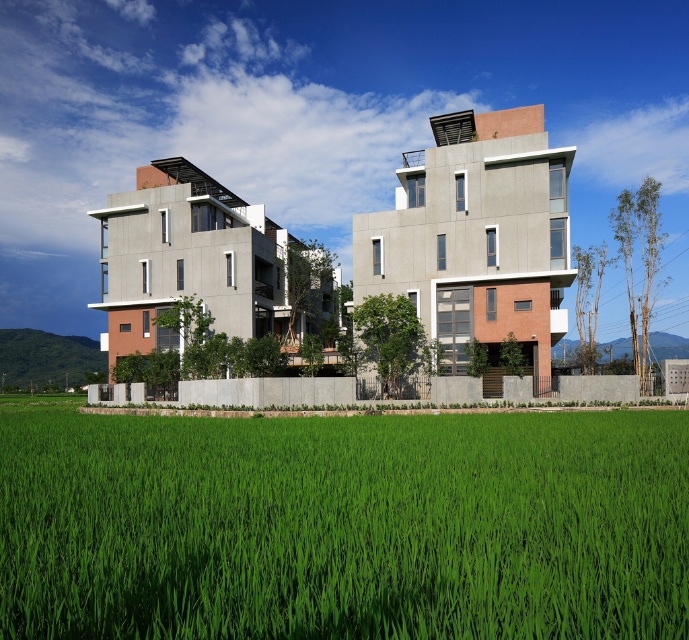
Question: Which of the following is the closest to the observer?

Choices:
 (A) (74, 342)
 (B) (661, 568)

Answer: (B)

Question: Which point is closer to the camera?

Choices:
 (A) (14, 337)
 (B) (240, 468)

Answer: (B)

Question: Can you confirm if green grass at lower center is wider than green grassy hillside at center?

Choices:
 (A) yes
 (B) no

Answer: (B)

Question: Which object appears farthest from the camera in this image?

Choices:
 (A) green grass at lower center
 (B) green grassy hillside at center

Answer: (B)

Question: In this image, where is green grass at lower center located relative to green grassy hillside at center?

Choices:
 (A) left
 (B) right

Answer: (B)

Question: Can you confirm if green grass at lower center is positioned above green grassy hillside at center?

Choices:
 (A) no
 (B) yes

Answer: (B)